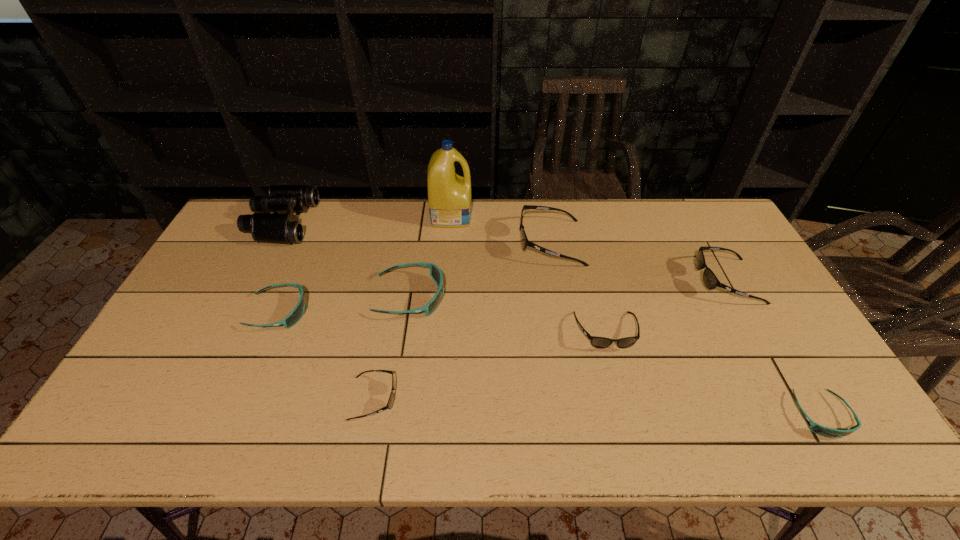
Find the location of a particular element. This screenshot has width=960, height=540. the tallest object is located at coordinates (449, 195).

Where is `binoculars`? binoculars is located at coordinates (285, 228).

This screenshot has width=960, height=540. I want to click on black binoculars, so click(285, 228).

Locate an element on the screen. the third tallest object is located at coordinates (525, 242).

You are a GUI agent. You are given a task and a screenshot of the screen. Output one action in this format:
    pyautogui.click(x=<x>, y=<y>)
    Task: Click on the biggest gray sunglasses
    The width and height of the screenshot is (960, 540).
    Given the screenshot: What is the action you would take?
    pyautogui.click(x=525, y=242)

Image resolution: width=960 pixels, height=540 pixels. Identify the location of the rightmost gray sunglasses. (710, 280).

Identify the location of the biggest cyan sunglasses. (435, 272).

Image resolution: width=960 pixels, height=540 pixels. Identify the location of the second nearest gray sunglasses. pyautogui.click(x=598, y=342).

Find the location of a particular element. the leftmost cyan sunglasses is located at coordinates (296, 314).

This screenshot has width=960, height=540. In order to click on the leftmost sunglasses in this screenshot , I will do `click(296, 314)`.